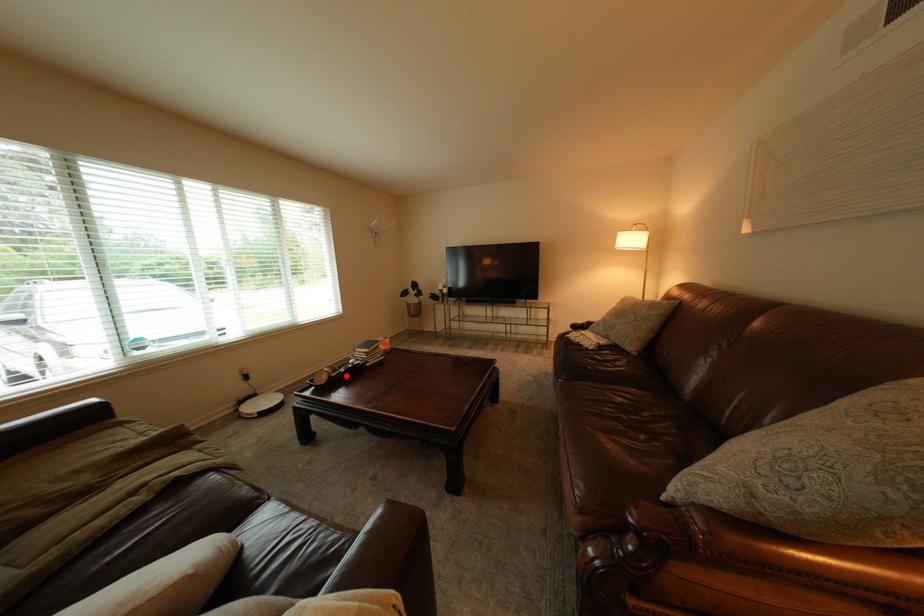
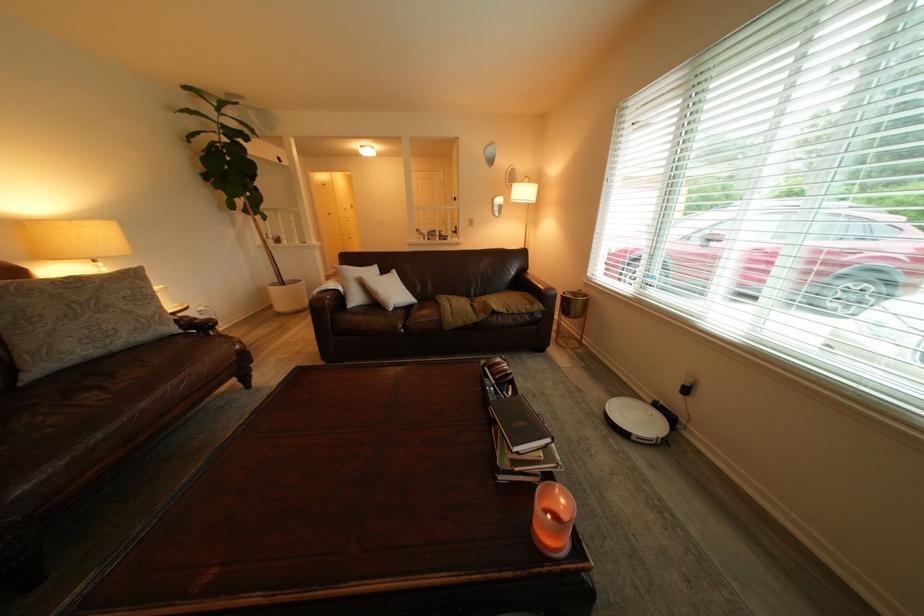
Where in the second image is the point corresponding to the highlighted location from the first image?

(500, 369)